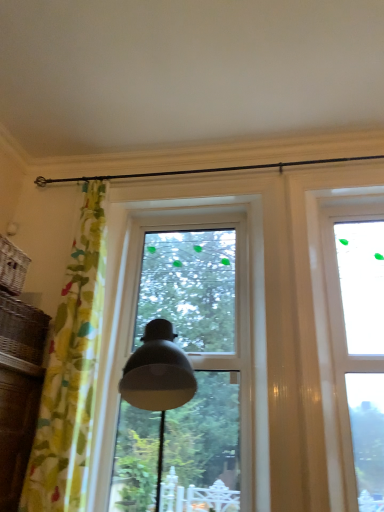
Question: Considering the relative sizes of transparent glass window at upper right, the second window in the left-to-right sequence, and transparent glass window at center, arranged as the 2th window when viewed from the right, in the image provided, is transparent glass window at upper right, the second window in the left-to-right sequence, smaller than transparent glass window at center, arranged as the 2th window when viewed from the right,?

Choices:
 (A) no
 (B) yes

Answer: (B)

Question: Is transparent glass window at upper right, the second window in the left-to-right sequence, aimed at transparent glass window at center, arranged as the 2th window when viewed from the right?

Choices:
 (A) yes
 (B) no

Answer: (B)

Question: Can transparent glass window at center, arranged as the 2th window when viewed from the right, be found inside transparent glass window at upper right, the second window in the left-to-right sequence?

Choices:
 (A) yes
 (B) no

Answer: (B)

Question: Can you confirm if transparent glass window at upper right, the second window in the left-to-right sequence, is bigger than transparent glass window at center, arranged as the 2th window when viewed from the right?

Choices:
 (A) yes
 (B) no

Answer: (B)

Question: Can you confirm if transparent glass window at upper right, which is counted as the 1th window, starting from the right, is thinner than transparent glass window at center, arranged as the 2th window when viewed from the right?

Choices:
 (A) yes
 (B) no

Answer: (B)

Question: From the image's perspective, is transparent glass window at upper right, the second window in the left-to-right sequence, above transparent glass window at center, marked as the first window in a left-to-right arrangement?

Choices:
 (A) yes
 (B) no

Answer: (A)

Question: Can you confirm if transparent glass window at center, marked as the first window in a left-to-right arrangement, is wider than transparent glass window at upper right, which is counted as the 1th window, starting from the right?

Choices:
 (A) no
 (B) yes

Answer: (A)

Question: Considering the relative sizes of transparent glass window at center, marked as the first window in a left-to-right arrangement, and transparent glass window at upper right, the second window in the left-to-right sequence, in the image provided, is transparent glass window at center, marked as the first window in a left-to-right arrangement, bigger than transparent glass window at upper right, the second window in the left-to-right sequence,?

Choices:
 (A) no
 (B) yes

Answer: (B)

Question: Are transparent glass window at center, arranged as the 2th window when viewed from the right, and transparent glass window at upper right, the second window in the left-to-right sequence, far apart?

Choices:
 (A) no
 (B) yes

Answer: (A)

Question: Does transparent glass window at center, arranged as the 2th window when viewed from the right, appear on the right side of transparent glass window at upper right, which is counted as the 1th window, starting from the right?

Choices:
 (A) no
 (B) yes

Answer: (A)

Question: Considering the relative positions of transparent glass window at center, marked as the first window in a left-to-right arrangement, and transparent glass window at upper right, the second window in the left-to-right sequence, in the image provided, is transparent glass window at center, marked as the first window in a left-to-right arrangement, behind transparent glass window at upper right, the second window in the left-to-right sequence,?

Choices:
 (A) yes
 (B) no

Answer: (A)

Question: Is transparent glass window at center, arranged as the 2th window when viewed from the right, shorter than transparent glass window at upper right, the second window in the left-to-right sequence?

Choices:
 (A) no
 (B) yes

Answer: (A)

Question: Considering the relative sizes of woven brown basket at left, which ranks as the 2th basket in top-to-bottom order, and yellow floral fabric curtain at left in the image provided, is woven brown basket at left, which ranks as the 2th basket in top-to-bottom order, shorter than yellow floral fabric curtain at left?

Choices:
 (A) yes
 (B) no

Answer: (A)